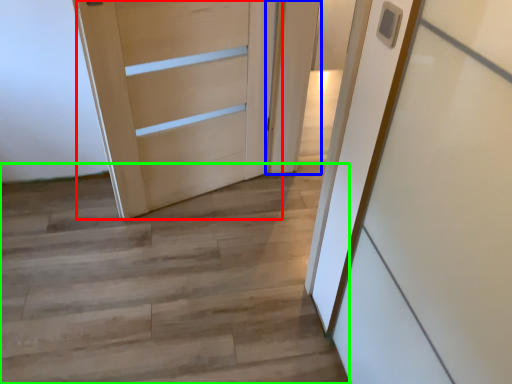
Question: Considering the real-world distances, which object is closest to door (highlighted by a red box)? door (highlighted by a blue box) or stairwell (highlighted by a green box).

Choices:
 (A) door
 (B) stairwell

Answer: (A)